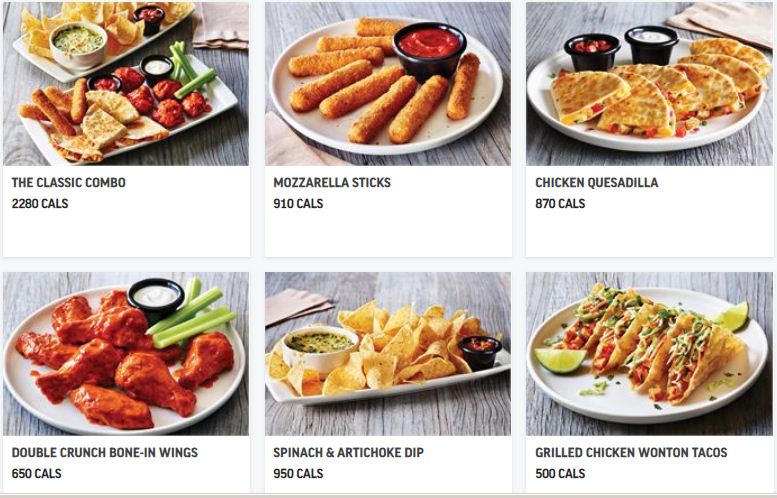
This screenshot has height=498, width=777. I want to click on rectangle plate, so (280, 395), (47, 146), (51, 69).